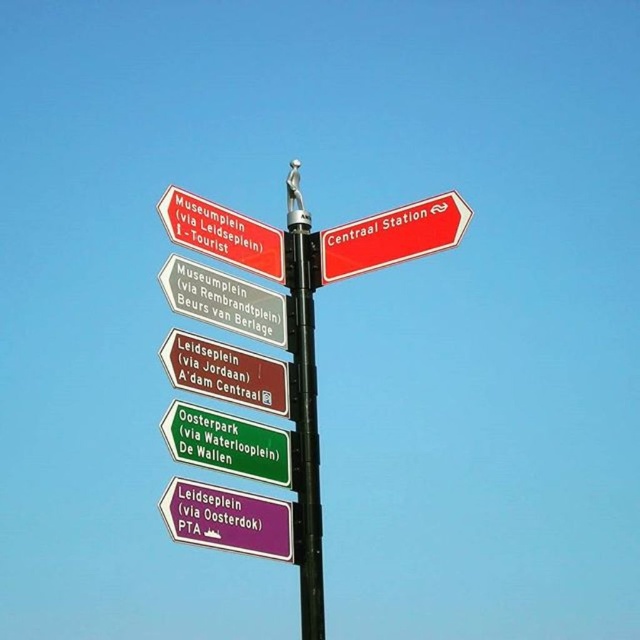
Between point (220, 284) and point (212, 256), which one is positioned behind?

The point (212, 256) is more distant.

This screenshot has height=640, width=640. I want to click on white plastic sign at center, so click(x=224, y=300).

What do you see at coordinates (224, 300) in the screenshot?
I see `white plastic sign at center` at bounding box center [224, 300].

Locate an element on the screen. This screenshot has height=640, width=640. white plastic sign at center is located at coordinates [x=224, y=300].

Between green matte signpost at lower center and matte brown signpost at center, which one appears on the right side from the viewer's perspective?

A: From the viewer's perspective, green matte signpost at lower center appears more on the right side.

Between point (280, 472) and point (276, 364), which one is positioned behind?

Point (276, 364)

Describe the element at coordinates (227, 444) in the screenshot. I see `green matte signpost at lower center` at that location.

This screenshot has width=640, height=640. I want to click on green matte signpost at lower center, so click(227, 444).

Between point (236, 500) and point (244, 385), which one is positioned in front?

Point (236, 500)

Is purple matte sign at lower center bigger than matte brown signpost at center?

No.

Is point (188, 497) positioned before point (275, 410)?

Yes.

The height and width of the screenshot is (640, 640). I want to click on purple matte sign at lower center, so click(227, 518).